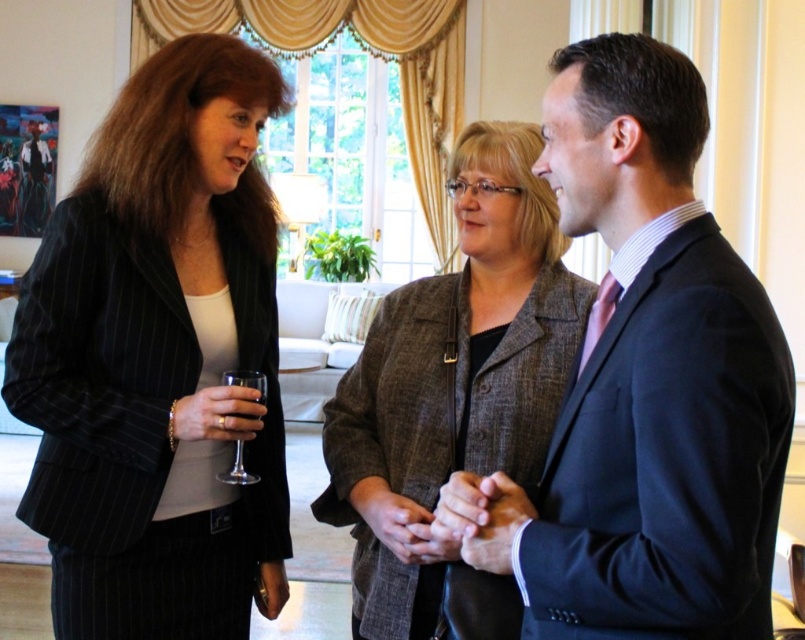
You are a photographer at the event and want to take a photo of the matte black suit at center without the clear glass wine glass at left appearing in the foreground. Is this possible given their positions?

The matte black suit at center is positioned over the clear glass wine glass at left, so the suit is in front of the wine glass. Therefore, the photographer can take a photo of the matte black suit at center without the clear glass wine glass at left appearing in the foreground by focusing on the suit since it is closer to the camera.

From the picture: Based on the coordinates provided, where exactly is the matte black suit at center located in the image?

The matte black suit at center is located at point coordinates of 0.602 on the x axis and 0.801 on the y axis.

You are a photographer at the event and want to position a spotlight on the matte black suit at center. The spotlight can only be placed at the coordinates point (644,385). Is this the correct location to target the matte black suit at center?

Yes, the matte black suit at center is represented by point (644,385), so placing the spotlight at those coordinates will correctly target the matte black suit at center.